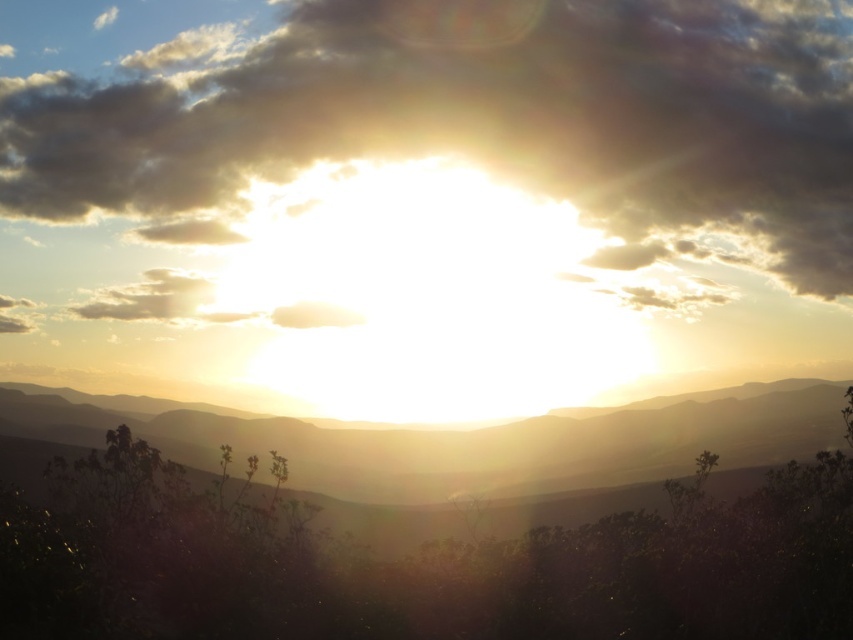
You are standing in the mountain landscape and want to take a photo of both the point at coordinates (560, 131) and the point at coordinates (796, 394). Which point will appear closer to the camera in your photo?

The point at coordinates (560, 131) will appear closer to the camera because it is further to the camera than the point at coordinates (796, 394).

You are an artist planning to paint the sunset scene. You want to ensure the cloudy sky at upper center and the silhouetted rock formation at center are proportionally accurate. Based on the scene, which object takes up more space in the image?

Answer: The silhouetted rock formation at center takes up more space than the cloudy sky at upper center according to the description.

You are standing at the base of the mountain and want to take a photo of the cloudy sky at upper center using a camera. The camera requires you to be within 40 meters to capture the scene properly. Can you take the photo without moving closer?

The cloudy sky at upper center and camera are 38.90 meters apart from each other. Since 38.90 meters is within the 40 meters requirement, you can take the photo without moving closer.